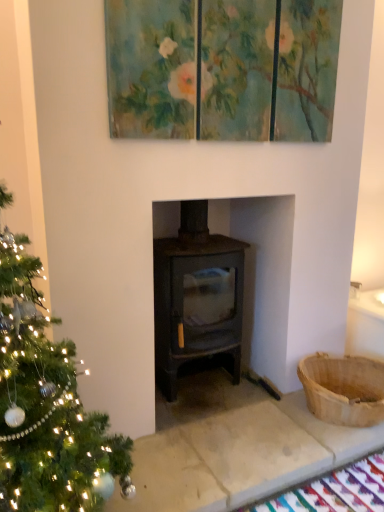
Question: Is brown woven basket at right taller than teal textured triptych at upper center?

Choices:
 (A) yes
 (B) no

Answer: (B)

Question: Can you confirm if brown woven basket at right is positioned to the right of teal textured triptych at upper center?

Choices:
 (A) yes
 (B) no

Answer: (A)

Question: Is brown woven basket at right beside teal textured triptych at upper center?

Choices:
 (A) no
 (B) yes

Answer: (A)

Question: Does brown woven basket at right have a lesser height compared to teal textured triptych at upper center?

Choices:
 (A) yes
 (B) no

Answer: (A)

Question: Is brown woven basket at right further to camera compared to teal textured triptych at upper center?

Choices:
 (A) yes
 (B) no

Answer: (A)

Question: Is teal textured triptych at upper center spatially inside brown woven basket at right, or outside of it?

Choices:
 (A) outside
 (B) inside

Answer: (A)

Question: Visually, is teal textured triptych at upper center positioned to the left or to the right of brown woven basket at right?

Choices:
 (A) left
 (B) right

Answer: (A)

Question: From a real-world perspective, is teal textured triptych at upper center above or below brown woven basket at right?

Choices:
 (A) below
 (B) above

Answer: (B)

Question: Considering the positions of teal textured triptych at upper center and brown woven basket at right in the image, is teal textured triptych at upper center bigger or smaller than brown woven basket at right?

Choices:
 (A) big
 (B) small

Answer: (A)

Question: Does point (162, 136) appear closer or farther from the camera than point (268, 215)?

Choices:
 (A) farther
 (B) closer

Answer: (B)

Question: From a real-world perspective, relative to matte black stove at center, is teal textured triptych at upper center vertically above or below?

Choices:
 (A) above
 (B) below

Answer: (A)

Question: Is teal textured triptych at upper center taller or shorter than matte black stove at center?

Choices:
 (A) tall
 (B) short

Answer: (B)

Question: Is teal textured triptych at upper center bigger or smaller than matte black stove at center?

Choices:
 (A) big
 (B) small

Answer: (B)

Question: Considering the positions of brown woven basket at right and matte black stove at center in the image, is brown woven basket at right wider or thinner than matte black stove at center?

Choices:
 (A) wide
 (B) thin

Answer: (B)

Question: Considering the positions of brown woven basket at right and matte black stove at center in the image, is brown woven basket at right bigger or smaller than matte black stove at center?

Choices:
 (A) small
 (B) big

Answer: (A)